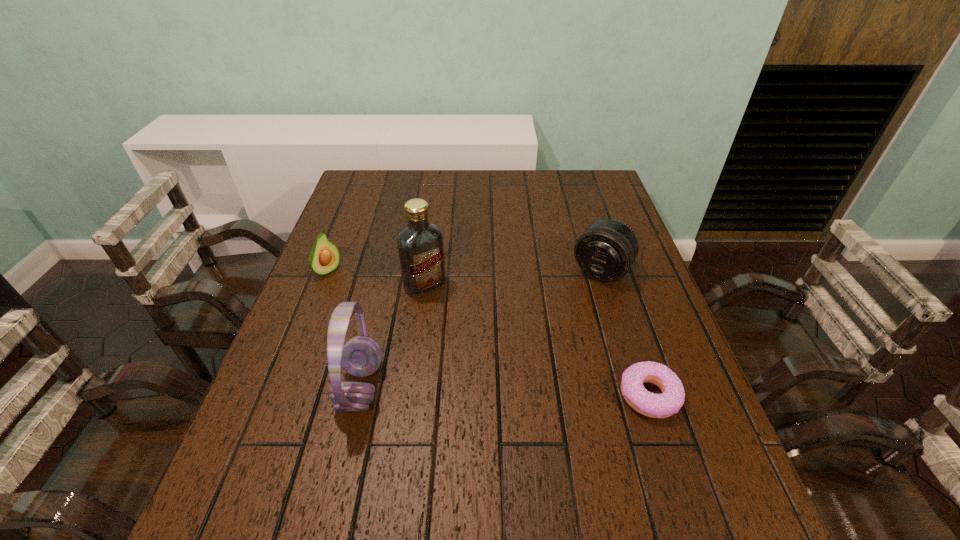
Where is `vacant space at the far right corner of the desktop`? Image resolution: width=960 pixels, height=540 pixels. vacant space at the far right corner of the desktop is located at coordinates click(589, 201).

Find the location of a particular element. The width and height of the screenshot is (960, 540). free space at the near right corner is located at coordinates (705, 452).

Where is `free space that is in between the fourth shortest object and the shortest object`? free space that is in between the fourth shortest object and the shortest object is located at coordinates (506, 391).

Identify the location of empty location between the leftmost object and the third object from left to right. (376, 278).

Identify the location of free space between the shortest object and the leftmost object. (490, 334).

Locate an element on the screen. The image size is (960, 540). free space between the third shortest object and the doughnut is located at coordinates tap(626, 333).

You are a GUI agent. You are given a task and a screenshot of the screen. Output one action in this format:
    pyautogui.click(x=<x>, y=<y>)
    Task: Click on the blank region between the third tallest object and the shortest object
    The width and height of the screenshot is (960, 540).
    Given the screenshot: What is the action you would take?
    pyautogui.click(x=626, y=333)

You are a GUI agent. You are given a task and a screenshot of the screen. Output one action in this format:
    pyautogui.click(x=<x>, y=<y>)
    Task: Click on the unoccupied position between the shortest object and the avocado
    The height and width of the screenshot is (540, 960).
    Given the screenshot: What is the action you would take?
    pyautogui.click(x=490, y=334)

Identify the location of free point between the leftmost object and the shortest object. click(x=490, y=334).

At what (x,y) coordinates should I click in order to perform the action: click on free space between the telephoto lens and the tallest object. Please return your answer as a coordinate pair (x, y). The image size is (960, 540). Looking at the image, I should click on (513, 277).